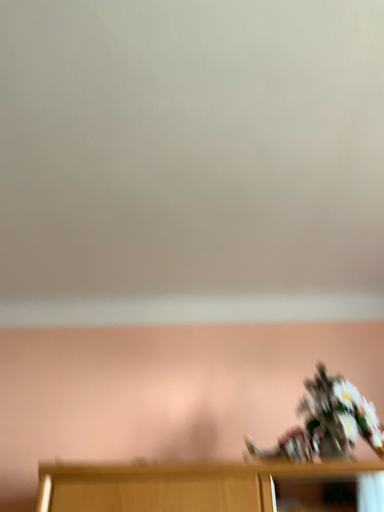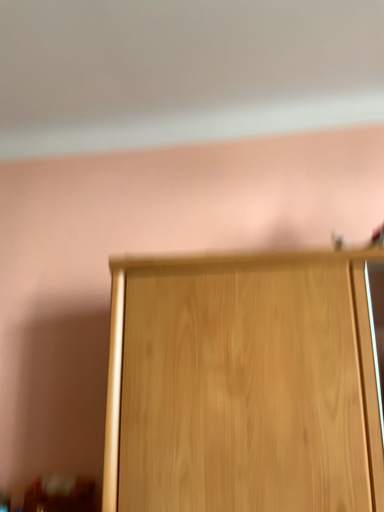
Question: Which way did the camera rotate in the video?

Choices:
 (A) rotated left
 (B) rotated right

Answer: (A)